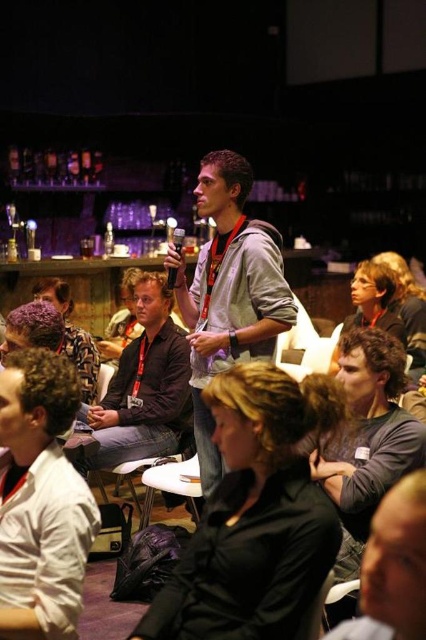
Question: Based on their relative distances, which object is farther from the black matte shirt at center?

Choices:
 (A) dark brown hair at lower left
 (B) dark gray shirt at center
 (C) gray hoodie at center
 (D) dark brown hair at center

Answer: (D)

Question: Does dark gray hoodie at center have a lesser width compared to dark brown hair at center?

Choices:
 (A) no
 (B) yes

Answer: (B)

Question: In this image, where is dark gray hoodie at center located relative to dark brown hair at center?

Choices:
 (A) above
 (B) below

Answer: (B)

Question: Can you confirm if black matte shirt at center is positioned to the right of gray hoodie at center?

Choices:
 (A) yes
 (B) no

Answer: (A)

Question: Which point appears farthest from the camera in this image?

Choices:
 (A) (224, 628)
 (B) (368, 589)

Answer: (A)

Question: Which point is closer to the camera?

Choices:
 (A) white cotton shirt at lower left
 (B) dark gray shirt at center
 (C) gray hoodie at center
 (D) dark brown hair at lower left

Answer: (A)